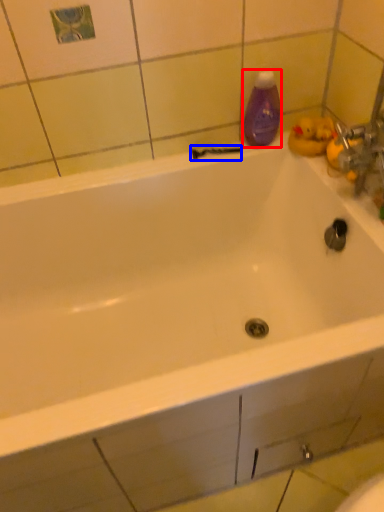
Question: Which object is further to the camera taking this photo, cleaning product (highlighted by a red box) or shower (highlighted by a blue box)?

Choices:
 (A) cleaning product
 (B) shower

Answer: (B)